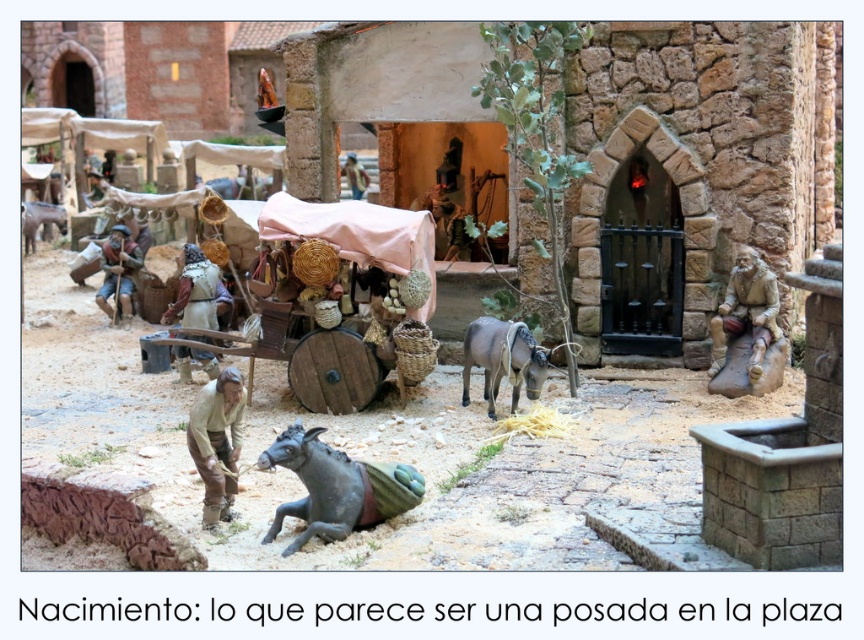
Consider the image. You are standing in the medieval town square and want to approach both the black matte donkey at lower center and the gray matte donkey at left. Which donkey will you reach first as you move forward?

You will reach the black matte donkey at lower center first because it is closer to you than the gray matte donkey at left.